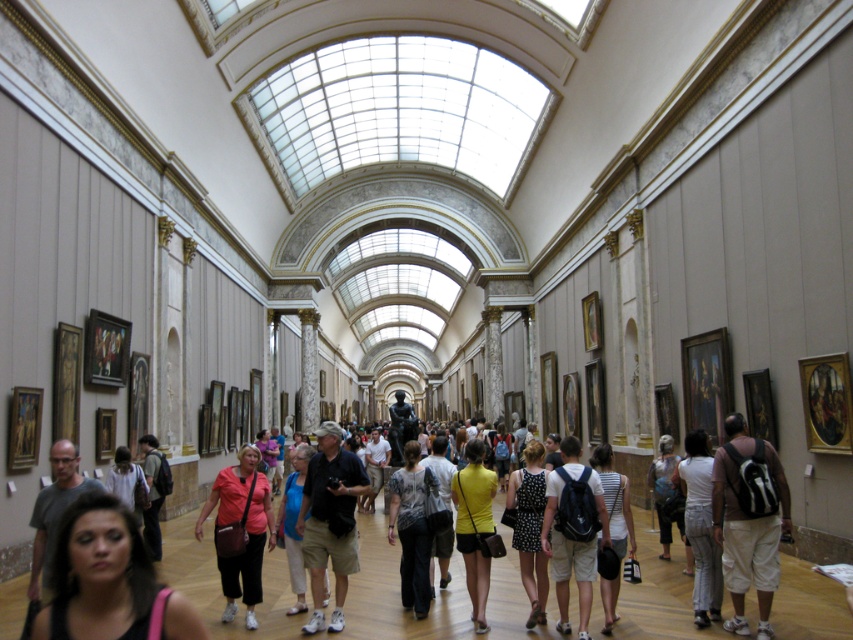
Is striped cotton shirt at center to the right of light pink fabric shirt at center from the viewer's perspective?

Correct, you'll find striped cotton shirt at center to the right of light pink fabric shirt at center.

The image size is (853, 640). In order to click on striped cotton shirt at center in this screenshot , I will do `click(614, 499)`.

Where is `striped cotton shirt at center`? The height and width of the screenshot is (640, 853). striped cotton shirt at center is located at coordinates (614, 499).

Who is more distant from viewer, (x=705, y=435) or (x=143, y=484)?

The point (x=143, y=484) is more distant.

Is white cotton pants at lower right positioned behind light pink fabric shirt at center?

Yes, white cotton pants at lower right is further from the viewer.

The width and height of the screenshot is (853, 640). Describe the element at coordinates (700, 525) in the screenshot. I see `white cotton pants at lower right` at that location.

Where is `white cotton pants at lower right`? white cotton pants at lower right is located at coordinates (700, 525).

Does white cotton pants at lower right appear on the left side of striped cotton shirt at center?

In fact, white cotton pants at lower right is to the right of striped cotton shirt at center.

Between point (711, 552) and point (624, 512), which one is positioned in front?

Point (711, 552)

Who is more distant from viewer, (703, 579) or (602, 480)?

Point (602, 480)

Image resolution: width=853 pixels, height=640 pixels. I want to click on white cotton pants at lower right, so click(x=700, y=525).